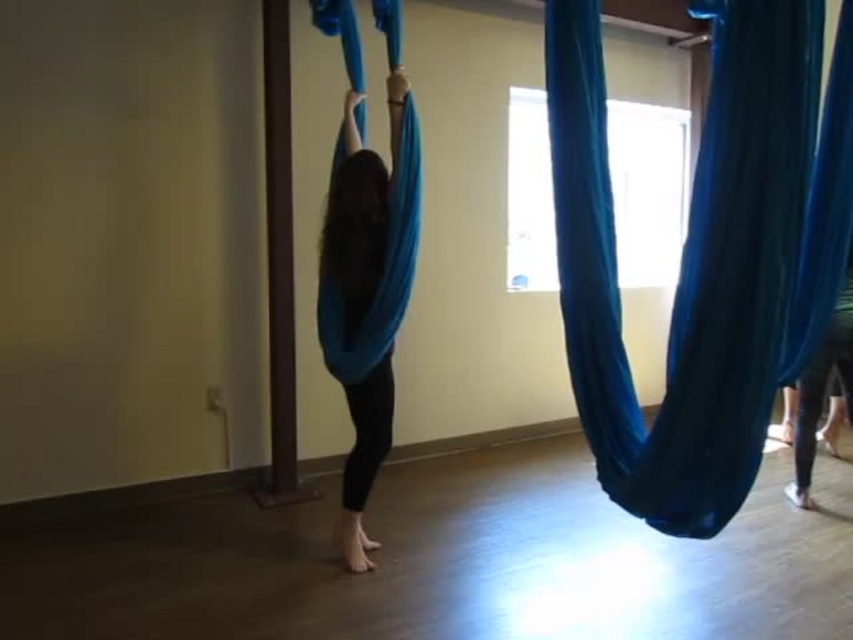
Question: Is blue fabric hammock at right below matte blue fabric at center?

Choices:
 (A) yes
 (B) no

Answer: (B)

Question: Which point appears closest to the camera in this image?

Choices:
 (A) (339, 316)
 (B) (650, 520)

Answer: (B)

Question: In this image, where is blue fabric hammock at right located relative to matte blue fabric at center?

Choices:
 (A) above
 (B) below

Answer: (A)

Question: Does blue fabric hammock at right have a lesser width compared to matte blue fabric at center?

Choices:
 (A) no
 (B) yes

Answer: (A)